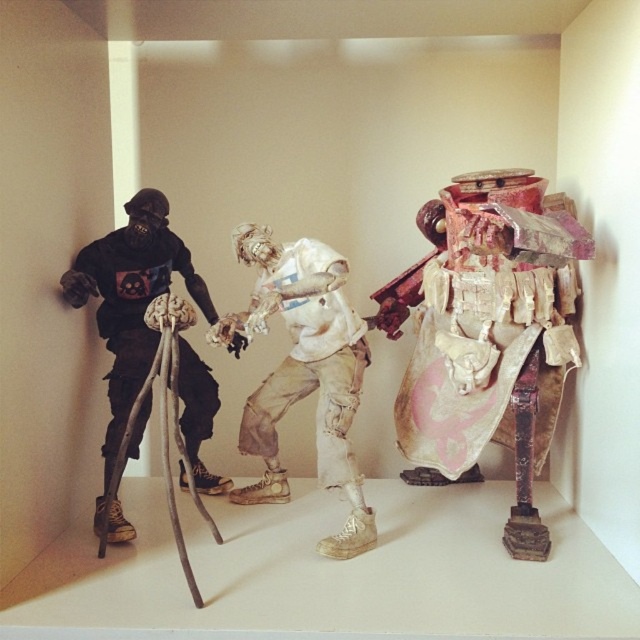
Based on the photo, you are standing in the room and want to move from the matte black figure at left to the white matte figure at center. Which direction should you move to reach it?

You should move to the right to reach the white matte figure at center since it is positioned to the right of the matte black figure at left.

You are a visitor in the room and need to reach the door located behind the middle figure. Which object, the distressed fabric shield at center or the matte black figure at left, is closer to the door?

The distressed fabric shield at center is closer to the door because it is positioned above the matte black figure at left, indicating it is nearer in the space.